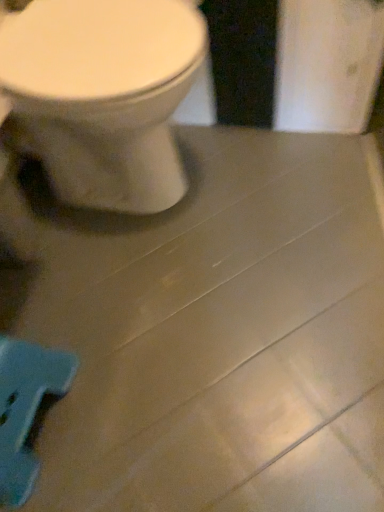
The image size is (384, 512). What are the coordinates of `vacant area that lies to the right of white glossy toilet at upper left` in the screenshot? It's located at (279, 185).